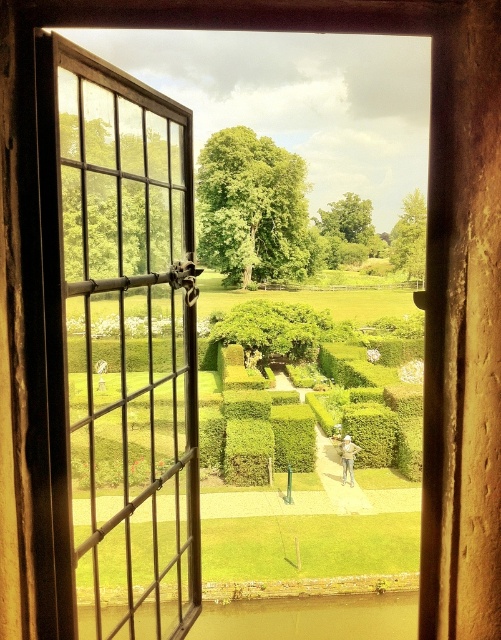
Question: Can you confirm if black metal window at left is smaller than smooth stone statue at center?

Choices:
 (A) no
 (B) yes

Answer: (A)

Question: Which point is closer to the camera?

Choices:
 (A) (55, 49)
 (B) (352, 480)

Answer: (A)

Question: Is black metal window at left smaller than smooth stone statue at center?

Choices:
 (A) yes
 (B) no

Answer: (B)

Question: Does black metal window at left have a lesser width compared to smooth stone statue at center?

Choices:
 (A) no
 (B) yes

Answer: (A)

Question: Which object is closer to the camera taking this photo?

Choices:
 (A) smooth stone statue at center
 (B) black metal window at left

Answer: (B)

Question: Which of the following is the closest to the observer?

Choices:
 (A) smooth stone statue at center
 (B) black metal window at left

Answer: (B)